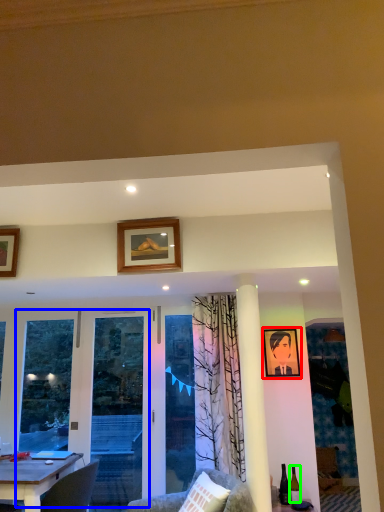
Question: Which is farther away from picture frame (highlighted by a red box)? screen door (highlighted by a blue box) or wine bottle (highlighted by a green box)?

Choices:
 (A) screen door
 (B) wine bottle

Answer: (A)